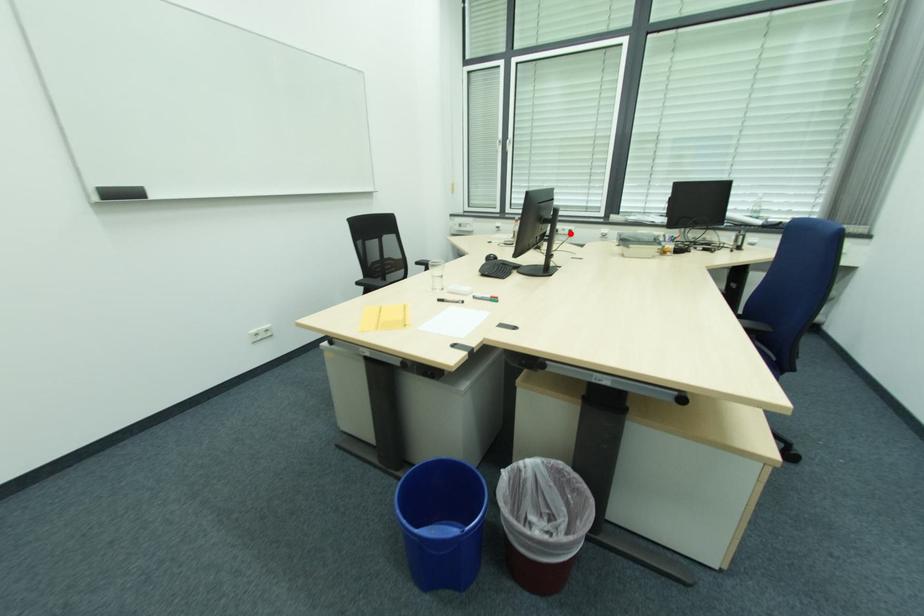
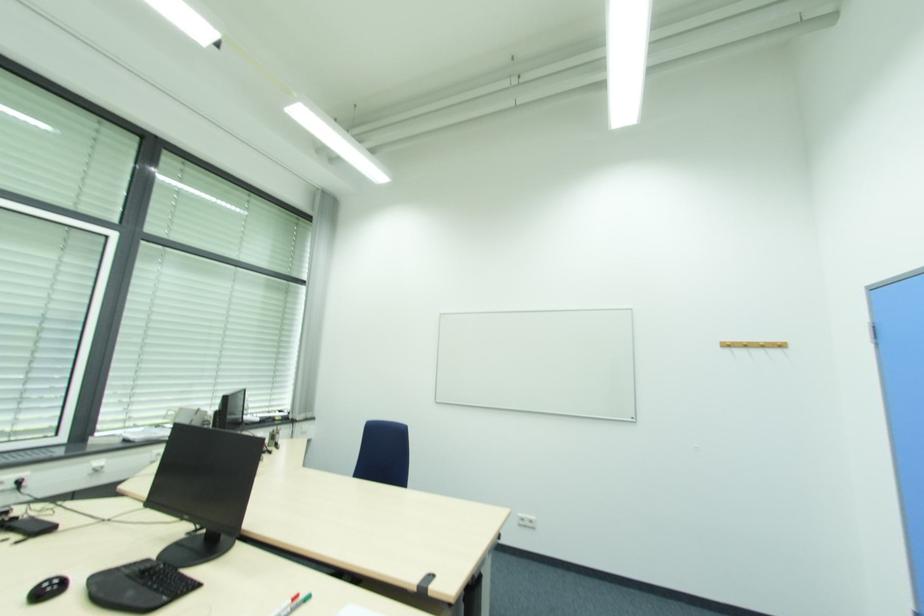
In the second image, find the point that corresponds to the highlighted location in the first image.

(17, 487)